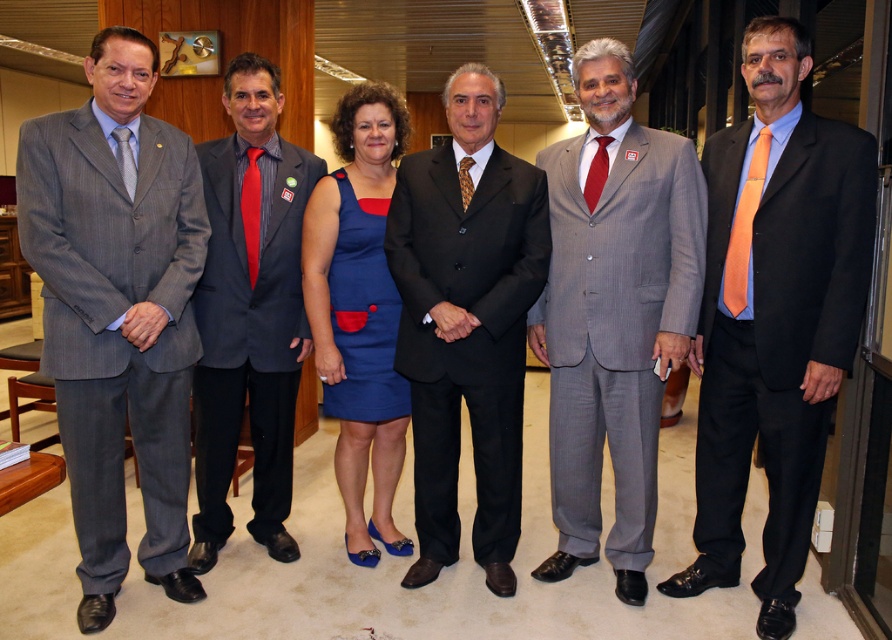
Can you confirm if orange silk suit at right is thinner than gray pinstripe suit at center?

Indeed, orange silk suit at right has a lesser width compared to gray pinstripe suit at center.

Is orange silk suit at right wider than gray pinstripe suit at center?

In fact, orange silk suit at right might be narrower than gray pinstripe suit at center.

Which is behind, point (814, 476) or point (618, 484)?

The point (618, 484) is behind.

Where is `orange silk suit at right`? The image size is (892, 640). orange silk suit at right is located at coordinates (778, 336).

Is striped fabric suit at center shorter than blue fabric dress at center?

Incorrect, striped fabric suit at center's height does not fall short of blue fabric dress at center's.

Who is positioned more to the left, striped fabric suit at center or blue fabric dress at center?

striped fabric suit at center is more to the left.

Where is `striped fabric suit at center`? The width and height of the screenshot is (892, 640). striped fabric suit at center is located at coordinates (249, 310).

You are a GUI agent. You are given a task and a screenshot of the screen. Output one action in this format:
    pyautogui.click(x=<x>, y=<y>)
    Task: Click on the striped fabric suit at center
    This screenshot has width=892, height=640.
    Given the screenshot: What is the action you would take?
    pyautogui.click(x=249, y=310)

Who is taller, gray pinstripe suit at left or black satin suit at center?

Standing taller between the two is gray pinstripe suit at left.

Does gray pinstripe suit at left have a lesser height compared to black satin suit at center?

No, gray pinstripe suit at left is not shorter than black satin suit at center.

Between point (67, 236) and point (435, 509), which one is positioned in front?

Point (67, 236) is in front.

Image resolution: width=892 pixels, height=640 pixels. I want to click on gray pinstripe suit at left, so click(x=117, y=310).